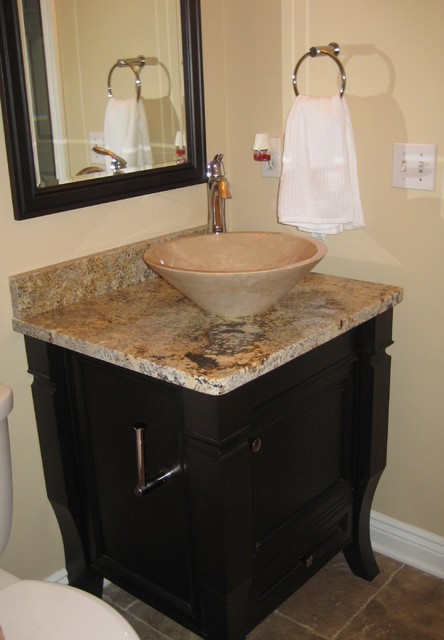
Find the location of a particular element. The height and width of the screenshot is (640, 444). backsplash is located at coordinates pos(73,300).